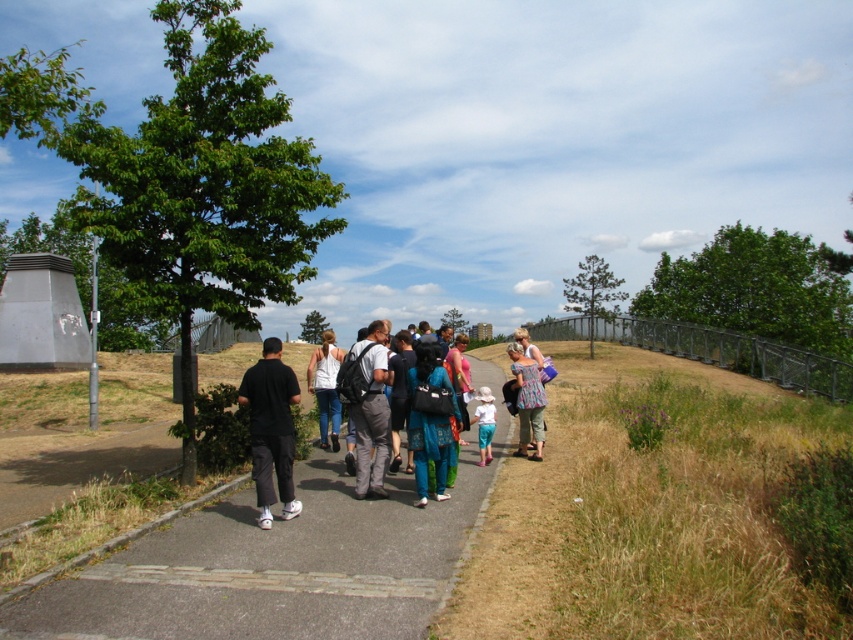
Question: Does matte black backpack at center lie in front of floral fabric dress at center?

Choices:
 (A) yes
 (B) no

Answer: (A)

Question: Which object is positioned farthest from the black matte pants at center?

Choices:
 (A) smooth asphalt sidewalk at center
 (B) white cotton tank top at center
 (C) blue fabric dress at center

Answer: (B)

Question: Can you confirm if smooth asphalt sidewalk at center is positioned above black matte pants at center?

Choices:
 (A) yes
 (B) no

Answer: (B)

Question: Can you confirm if smooth asphalt sidewalk at center is positioned to the right of white cotton tank top at center?

Choices:
 (A) no
 (B) yes

Answer: (B)

Question: Which point is farther from the camera taking this photo?

Choices:
 (A) (437, 490)
 (B) (535, 412)
 (C) (264, 413)
 (D) (392, 605)

Answer: (B)

Question: Which object is farther from the camera taking this photo?

Choices:
 (A) floral fabric dress at center
 (B) matte black backpack at center
 (C) white cotton tank top at center

Answer: (A)